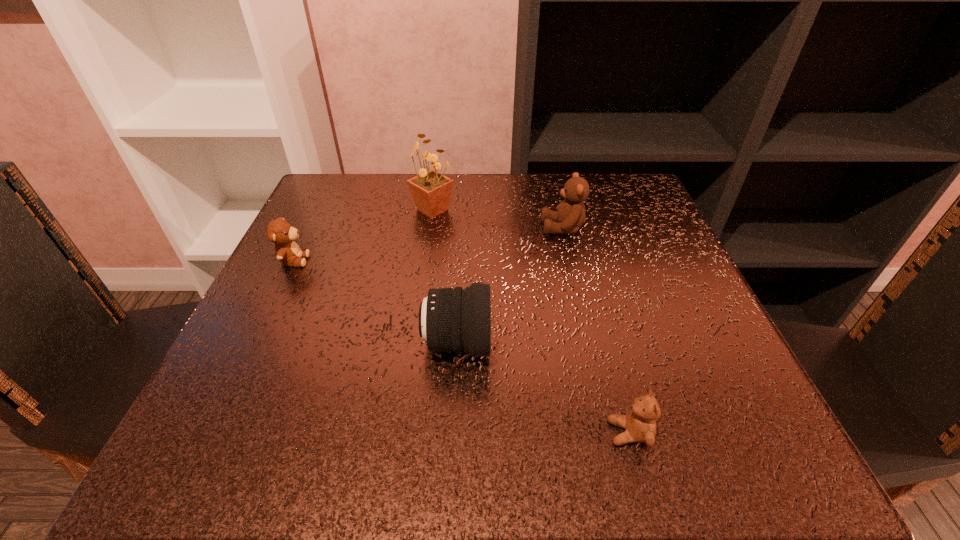
Where is `free space in the image that satisfies the following two spatial constraints: 1. at the front of the sunflower with flowers visible; 2. on the face of the second nearest teddy bear`? free space in the image that satisfies the following two spatial constraints: 1. at the front of the sunflower with flowers visible; 2. on the face of the second nearest teddy bear is located at coordinates (425, 260).

Locate an element on the screen. vacant region that satisfies the following two spatial constraints: 1. at the front of the sunflower with flowers visible; 2. on the face of the second nearest teddy bear is located at coordinates (425, 260).